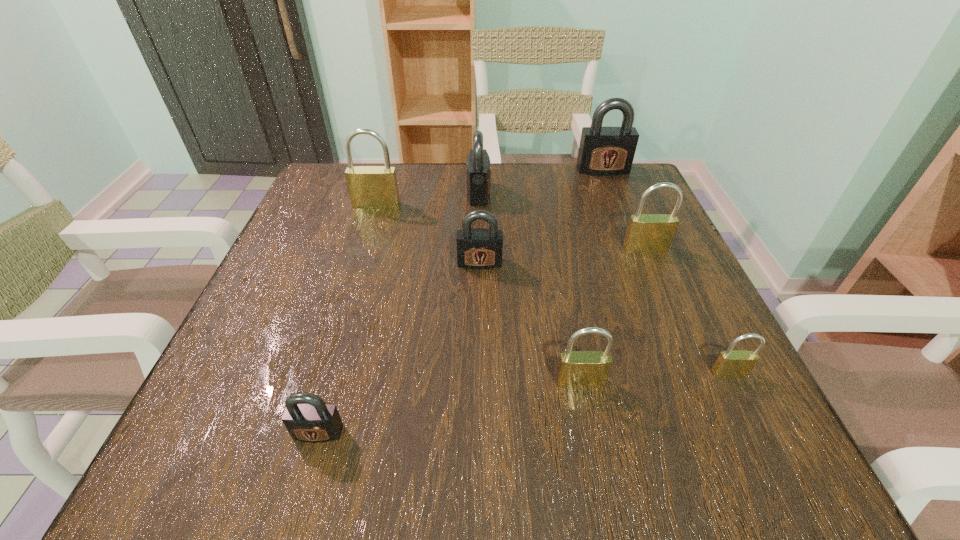
Image resolution: width=960 pixels, height=540 pixels. In order to click on the fourth object from right to left in this screenshot , I will do tap(577, 369).

I want to click on the leftmost gray padlock, so click(307, 417).

Identify the location of the nearest object. (307, 417).

I want to click on the smallest brass padlock, so click(730, 364).

Identify the location of free region located on the front of the biggest gray padlock near the keyhole. Image resolution: width=960 pixels, height=540 pixels. (615, 201).

The image size is (960, 540). I want to click on free spot located on the front-facing side of the leftmost brass padlock, so click(357, 269).

Locate an element on the screen. The image size is (960, 540). free region located 0.300m on the front of the third nearest gray padlock near the keyhole is located at coordinates (619, 193).

Where is `free spot located on the front-facing side of the third nearest brass padlock`? This screenshot has height=540, width=960. free spot located on the front-facing side of the third nearest brass padlock is located at coordinates (687, 345).

I want to click on vacant region located 0.340m on the front of the third farthest gray padlock near the keyhole, so click(480, 442).

This screenshot has height=540, width=960. Find the location of `vacant space located 0.100m on the front-facing side of the fifth object from left to right`. vacant space located 0.100m on the front-facing side of the fifth object from left to right is located at coordinates (594, 454).